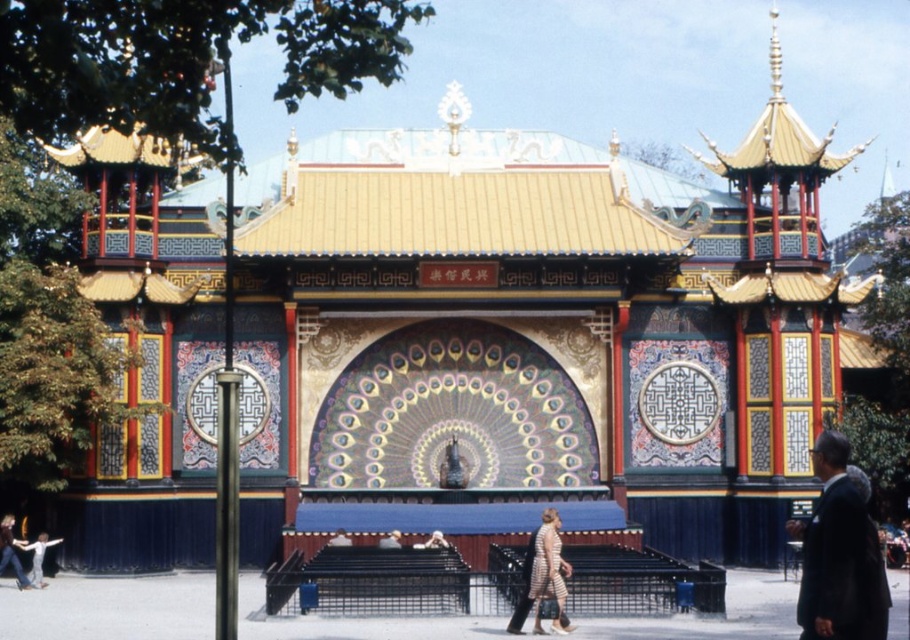
Can you confirm if dark suit at right is wider than striped fabric dress at center?

Yes.

Can you confirm if dark suit at right is taller than striped fabric dress at center?

Yes, dark suit at right is taller than striped fabric dress at center.

I want to click on dark suit at right, so pyautogui.click(x=838, y=554).